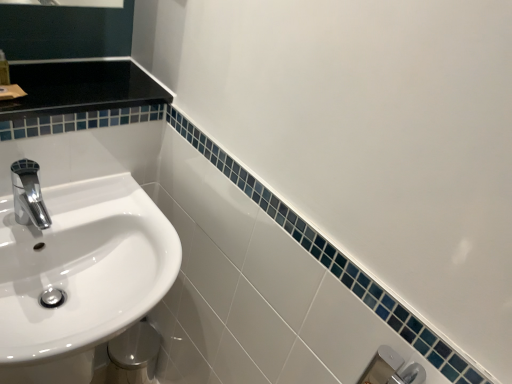
Question: Can you confirm if translucent plastic soap dispenser at upper left is thinner than white glossy sink at left?

Choices:
 (A) no
 (B) yes

Answer: (B)

Question: From a real-world perspective, is translucent plastic soap dispenser at upper left located higher than white glossy sink at left?

Choices:
 (A) yes
 (B) no

Answer: (A)

Question: From the image's perspective, is translucent plastic soap dispenser at upper left located beneath white glossy sink at left?

Choices:
 (A) yes
 (B) no

Answer: (B)

Question: Does translucent plastic soap dispenser at upper left have a greater height compared to white glossy sink at left?

Choices:
 (A) yes
 (B) no

Answer: (B)

Question: Is white glossy sink at left at the back of translucent plastic soap dispenser at upper left?

Choices:
 (A) yes
 (B) no

Answer: (B)

Question: Looking at the image, does translucent plastic soap dispenser at upper left seem bigger or smaller compared to white glossy sink at left?

Choices:
 (A) small
 (B) big

Answer: (A)

Question: From a real-world perspective, is translucent plastic soap dispenser at upper left above or below white glossy sink at left?

Choices:
 (A) below
 (B) above

Answer: (B)

Question: Relative to white glossy sink at left, is translucent plastic soap dispenser at upper left in front or behind?

Choices:
 (A) behind
 (B) front

Answer: (A)

Question: Considering the positions of point [x=1, y=64] and point [x=167, y=221], is point [x=1, y=64] closer or farther from the camera than point [x=167, y=221]?

Choices:
 (A) closer
 (B) farther

Answer: (A)

Question: From a real-world perspective, is chrome/metallic faucet at left above or below white glossy sink at left?

Choices:
 (A) above
 (B) below

Answer: (A)

Question: Considering the positions of chrome/metallic faucet at left and white glossy sink at left in the image, is chrome/metallic faucet at left taller or shorter than white glossy sink at left?

Choices:
 (A) tall
 (B) short

Answer: (B)

Question: From the image's perspective, is chrome/metallic faucet at left above or below white glossy sink at left?

Choices:
 (A) above
 (B) below

Answer: (A)

Question: In the image, is chrome/metallic faucet at left positioned in front of or behind white glossy sink at left?

Choices:
 (A) front
 (B) behind

Answer: (B)

Question: Is point (118, 256) positioned closer to the camera than point (18, 160)?

Choices:
 (A) farther
 (B) closer

Answer: (A)

Question: Based on their positions, is white glossy sink at left located to the left or right of chrome/metallic faucet at left?

Choices:
 (A) right
 (B) left

Answer: (A)